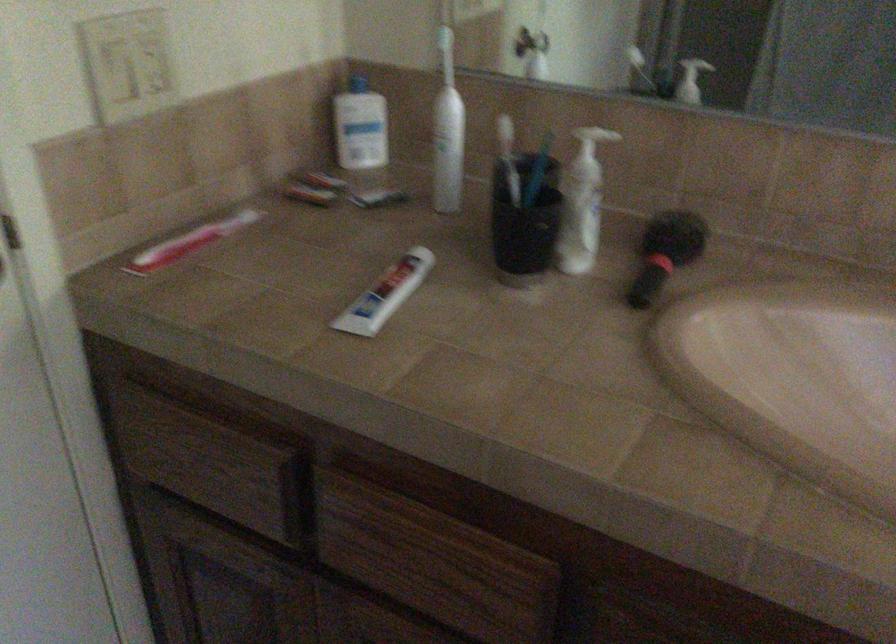
What do you see at coordinates (579, 225) in the screenshot? This screenshot has width=896, height=644. I see `the white dispenser pump` at bounding box center [579, 225].